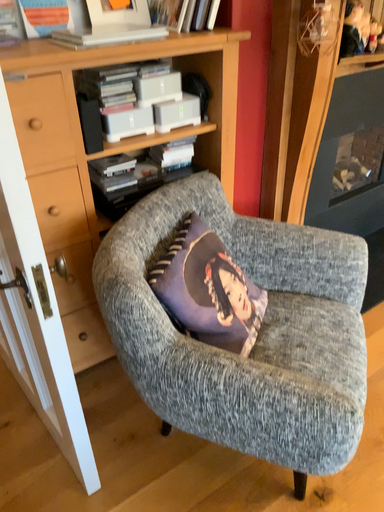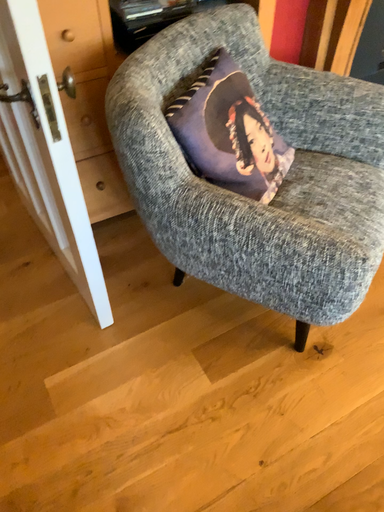
Question: How did the camera likely rotate when shooting the video?

Choices:
 (A) rotated downward
 (B) rotated upward

Answer: (A)